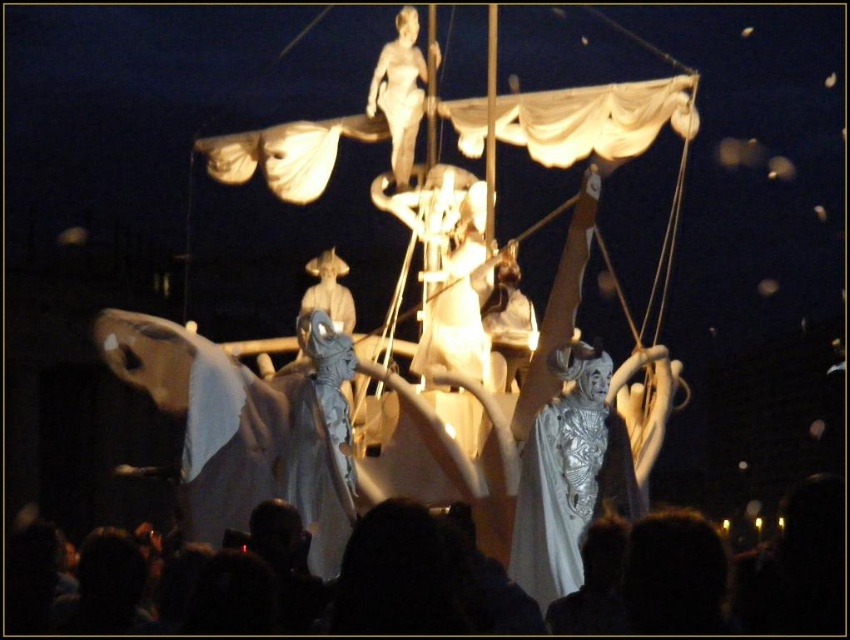
Question: Can you confirm if white fabric boat at center is positioned above silver textured statue at center?

Choices:
 (A) no
 (B) yes

Answer: (B)

Question: Among these points, which one is farthest from the camera?

Choices:
 (A) (522, 506)
 (B) (185, 524)
 (C) (417, 49)
 (D) (265, 474)

Answer: (C)

Question: Which object appears farthest from the camera in this image?

Choices:
 (A) silver textured statue at center
 (B) white fabric figure at center
 (C) smooth white statue at upper center

Answer: (C)

Question: Is white fabric figure at center further to camera compared to silver textured statue at center?

Choices:
 (A) no
 (B) yes

Answer: (A)

Question: Is white fabric boat at center below silver textured statue at center?

Choices:
 (A) yes
 (B) no

Answer: (B)

Question: Which is farther from the white fabric horse at center?

Choices:
 (A) silver textured statue at center
 (B) white fabric boat at center

Answer: (A)